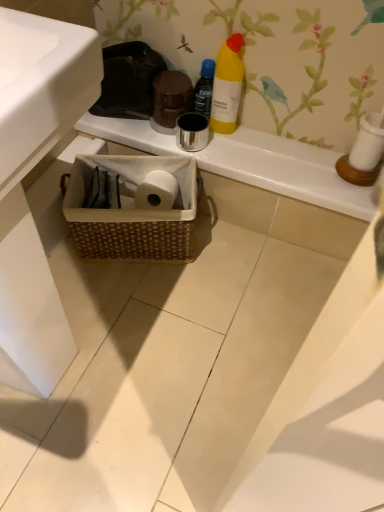
I want to click on free location in front of yellow matte bottle at upper center, positioned as the second bottle in right-to-left order, so click(x=229, y=149).